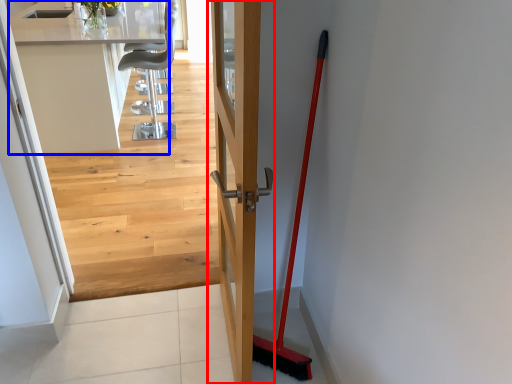
Question: Which point is further to the camera, door (highlighted by a red box) or counter top (highlighted by a blue box)?

Choices:
 (A) door
 (B) counter top

Answer: (B)